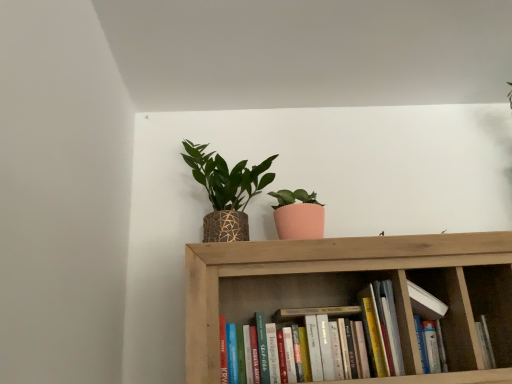
What are the coordinates of `white matte book at center, which ranks as the 2th book in left-to-right order` in the screenshot? It's located at (429, 327).

From the picture: What is the approximate height of white matte book at center, which ranks as the 2th book in left-to-right order?

white matte book at center, which ranks as the 2th book in left-to-right order, is 9.40 inches in height.

The width and height of the screenshot is (512, 384). What do you see at coordinates (352, 288) in the screenshot?
I see `wooden bookshelf at center` at bounding box center [352, 288].

I want to click on white matte book at center, positioned as the first book in right-to-left order, so click(429, 327).

Is point (475, 368) closer to viewer compared to point (295, 279)?

Yes, it is in front of point (295, 279).

Considering the positions of objects wooden bookshelf at center and hardcover books at center, the 1th book in the left-to-right sequence, in the image provided, who is in front, wooden bookshelf at center or hardcover books at center, the 1th book in the left-to-right sequence,?

wooden bookshelf at center.

How distant is white matte book at center, which ranks as the 2th book in left-to-right order, from wooden bookshelf at center?

The distance of white matte book at center, which ranks as the 2th book in left-to-right order, from wooden bookshelf at center is 8.57 inches.

From a real-world perspective, which is physically above, white matte book at center, which ranks as the 2th book in left-to-right order, or wooden bookshelf at center?

From a 3D spatial view, wooden bookshelf at center is above.

Could you tell me if white matte book at center, positioned as the first book in right-to-left order, is facing wooden bookshelf at center?

Yes.

Would you say white matte book at center, which ranks as the 2th book in left-to-right order, is inside or outside wooden bookshelf at center?

The correct answer is: inside.

Is wooden bookshelf at center spatially inside white matte book at center, positioned as the first book in right-to-left order, or outside of it?

wooden bookshelf at center is not enclosed by white matte book at center, positioned as the first book in right-to-left order.

Where is `the 1st book positioned below the wooden bookshelf at center (from a real-world perspective)`? The width and height of the screenshot is (512, 384). the 1st book positioned below the wooden bookshelf at center (from a real-world perspective) is located at coordinates tap(429, 327).

From a real-world perspective, relative to white matte book at center, positioned as the first book in right-to-left order, is wooden bookshelf at center vertically above or below?

In terms of real-world spatial position, wooden bookshelf at center is above white matte book at center, positioned as the first book in right-to-left order.

What's the angular difference between textured woven pot at upper center and white matte book at center, which ranks as the 2th book in left-to-right order,'s facing directions?

There is a 1.34-degree angle between the facing directions of textured woven pot at upper center and white matte book at center, which ranks as the 2th book in left-to-right order.

Is textured woven pot at upper center directly adjacent to white matte book at center, positioned as the first book in right-to-left order?

No.

From the image's perspective, which is below, textured woven pot at upper center or white matte book at center, positioned as the first book in right-to-left order?

From the image's view, white matte book at center, positioned as the first book in right-to-left order, is below.

Which object is thinner, textured woven pot at upper center or white matte book at center, positioned as the first book in right-to-left order?

Thinner between the two is white matte book at center, positioned as the first book in right-to-left order.

Considering the positions of point (393, 365) and point (209, 220), is point (393, 365) closer or farther from the camera than point (209, 220)?

Point (393, 365) appears to be closer to the viewer than point (209, 220).

Which object is more forward, hardcover books at center, the 1th book in the left-to-right sequence, or textured woven pot at upper center?

hardcover books at center, the 1th book in the left-to-right sequence.

Is hardcover books at center, the 1th book in the left-to-right sequence, looking in the opposite direction of textured woven pot at upper center?

No, hardcover books at center, the 1th book in the left-to-right sequence,'s orientation is not away from textured woven pot at upper center.

Would you consider hardcover books at center, the 1th book in the left-to-right sequence, to be distant from textured woven pot at upper center?

That's not correct — hardcover books at center, the 1th book in the left-to-right sequence, is a little close to textured woven pot at upper center.

Between point (373, 283) and point (293, 249), which one is positioned in front?

The point (293, 249) is closer to the camera.

What's the angular difference between hardcover books at center, the 1th book in the left-to-right sequence, and wooden bookshelf at center's facing directions?

There is a 3.47-degree angle between the facing directions of hardcover books at center, the 1th book in the left-to-right sequence, and wooden bookshelf at center.

Are hardcover books at center, placed as the 2th book when sorted from right to left, and wooden bookshelf at center making contact?

Indeed, hardcover books at center, placed as the 2th book when sorted from right to left, and wooden bookshelf at center are beside each other and touching.

From a real-world perspective, between hardcover books at center, placed as the 2th book when sorted from right to left, and wooden bookshelf at center, who is vertically higher?

wooden bookshelf at center is physically above.

Considering the relative sizes of white matte book at center, positioned as the first book in right-to-left order, and hardcover books at center, placed as the 2th book when sorted from right to left, in the image provided, is white matte book at center, positioned as the first book in right-to-left order, wider than hardcover books at center, placed as the 2th book when sorted from right to left,?

In fact, white matte book at center, positioned as the first book in right-to-left order, might be narrower than hardcover books at center, placed as the 2th book when sorted from right to left.

From the image's perspective, is white matte book at center, positioned as the first book in right-to-left order, above or below hardcover books at center, placed as the 2th book when sorted from right to left?

Based on their image positions, white matte book at center, positioned as the first book in right-to-left order, is located above hardcover books at center, placed as the 2th book when sorted from right to left.

The height and width of the screenshot is (384, 512). Identify the location of shelf above the hardcover books at center, placed as the 2th book when sorted from right to left (from a real-world perspective). (352, 288).

This screenshot has width=512, height=384. I want to click on book lying on the right of wooden bookshelf at center, so click(429, 327).

Looking at the image, which one is located further to hardcover books at center, placed as the 2th book when sorted from right to left, wooden bookshelf at center or white matte book at center, positioned as the first book in right-to-left order?

white matte book at center, positioned as the first book in right-to-left order, is further to hardcover books at center, placed as the 2th book when sorted from right to left.

Looking at the image, which one is located closer to wooden bookshelf at center, white matte book at center, positioned as the first book in right-to-left order, or textured woven pot at upper center?

white matte book at center, positioned as the first book in right-to-left order, is positioned closer to the anchor wooden bookshelf at center.

Which object lies nearer to the anchor point wooden bookshelf at center, textured woven pot at upper center or hardcover books at center, placed as the 2th book when sorted from right to left?

hardcover books at center, placed as the 2th book when sorted from right to left, is closer to wooden bookshelf at center.

Considering their positions, is textured woven pot at upper center positioned closer to hardcover books at center, the 1th book in the left-to-right sequence, than wooden bookshelf at center?

wooden bookshelf at center is closer to hardcover books at center, the 1th book in the left-to-right sequence.

Estimate the real-world distances between objects in this image. Which object is closer to white matte book at center, which ranks as the 2th book in left-to-right order, textured woven pot at upper center or wooden bookshelf at center?

Among the two, wooden bookshelf at center is located nearer to white matte book at center, which ranks as the 2th book in left-to-right order.

Which object lies further to the anchor point white matte book at center, which ranks as the 2th book in left-to-right order, textured woven pot at upper center or hardcover books at center, placed as the 2th book when sorted from right to left?

textured woven pot at upper center is positioned further to the anchor white matte book at center, which ranks as the 2th book in left-to-right order.

When comparing their distances from white matte book at center, which ranks as the 2th book in left-to-right order, does hardcover books at center, placed as the 2th book when sorted from right to left, or wooden bookshelf at center seem closer?

hardcover books at center, placed as the 2th book when sorted from right to left, lies closer to white matte book at center, which ranks as the 2th book in left-to-right order, than the other object.

Based on their spatial positions, is white matte book at center, positioned as the first book in right-to-left order, or wooden bookshelf at center closer to hardcover books at center, placed as the 2th book when sorted from right to left?

Based on the image, wooden bookshelf at center appears to be nearer to hardcover books at center, placed as the 2th book when sorted from right to left.

Locate an element on the screen. This screenshot has height=384, width=512. shelf between hardcover books at center, the 1th book in the left-to-right sequence, and white matte book at center, which ranks as the 2th book in left-to-right order, in the horizontal direction is located at coordinates (352, 288).

At what (x,y) coordinates should I click in order to perform the action: click on book between textured woven pot at upper center and white matte book at center, which ranks as the 2th book in left-to-right order, from left to right. Please return your answer as a coordinate pair (x, y). Looking at the image, I should click on (292, 298).

Locate an element on the screen. shelf between textured woven pot at upper center and white matte book at center, which ranks as the 2th book in left-to-right order, from left to right is located at coordinates (352, 288).

Where is `shelf between textured woven pot at upper center and hardcover books at center, placed as the 2th book when sorted from right to left, in the vertical direction`? The width and height of the screenshot is (512, 384). shelf between textured woven pot at upper center and hardcover books at center, placed as the 2th book when sorted from right to left, in the vertical direction is located at coordinates (352, 288).